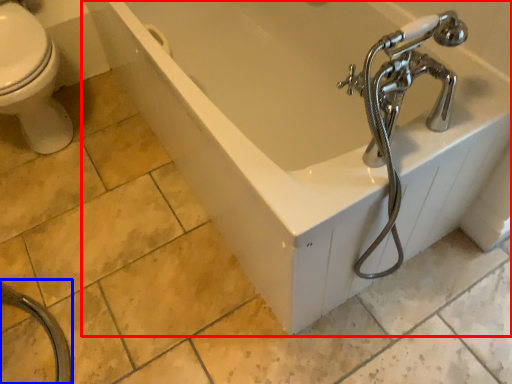
Question: Among these objects, which one is farthest to the camera, bathtub (highlighted by a red box) or garden hose (highlighted by a blue box)?

Choices:
 (A) bathtub
 (B) garden hose

Answer: (A)